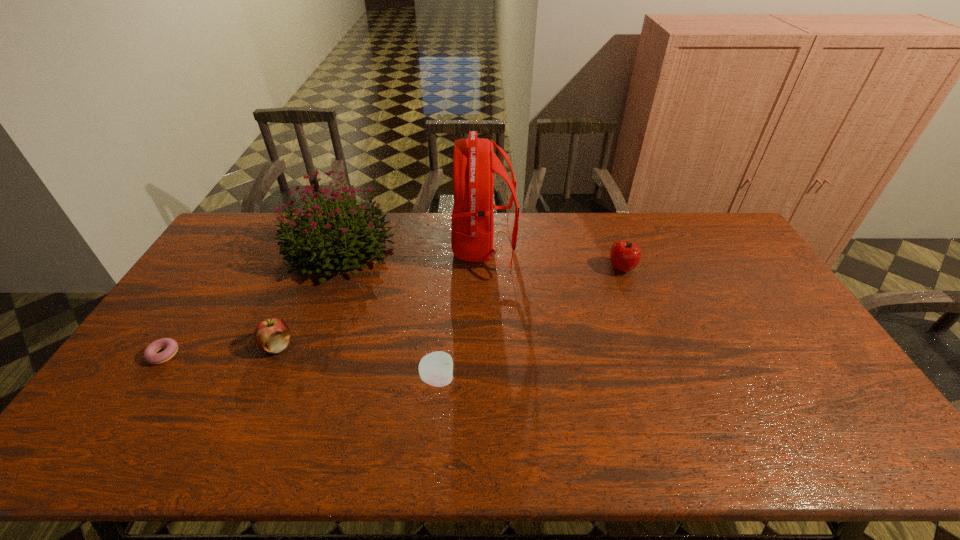
You are a GUI agent. You are given a task and a screenshot of the screen. Output one action in this format:
    pyautogui.click(x=<x>, y=<y>)
    Task: Click on the free region that satisfies the following two spatial constraints: 1. on the back side of the leftmost apple; 2. on the right side of the fifth shortest object
    This screenshot has height=540, width=960.
    Given the screenshot: What is the action you would take?
    pyautogui.click(x=320, y=248)

You are a GUI agent. You are given a task and a screenshot of the screen. Output one action in this format:
    pyautogui.click(x=<x>, y=<y>)
    Task: Click on the free spot that satisfies the following two spatial constraints: 1. on the main compartment of the fourth shortest object; 2. on the right side of the backpack
    
    Given the screenshot: What is the action you would take?
    pyautogui.click(x=484, y=268)

Locate an element on the screen. free space in the image that satisfies the following two spatial constraints: 1. on the main compartment of the tallest object; 2. on the left side of the fourth shortest object is located at coordinates (484, 268).

Identify the location of vacant space that satisfies the following two spatial constraints: 1. on the back side of the second apple from right to left; 2. on the left side of the rightmost apple. This screenshot has height=540, width=960. (447, 268).